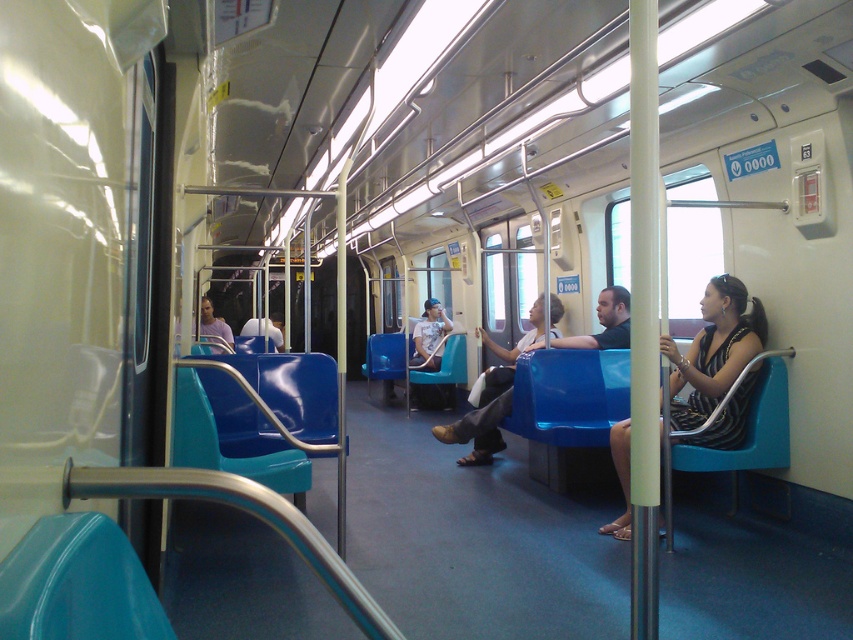
You are a passenger on the subway train and want to sit down. You see the striped fabric dress at center and the matte blue seat at center. Which one is wider?

The matte blue seat at center is wider than the striped fabric dress at center.

You are a passenger trying to sit down on the matte blue seat at center. There is a striped fabric dress at center already occupying part of the seat. Can you estimate if there is enough space for you to sit comfortably?

The striped fabric dress at center has a smaller size compared to matte blue seat at center, so there should be enough space for you to sit comfortably on the matte blue seat at center.